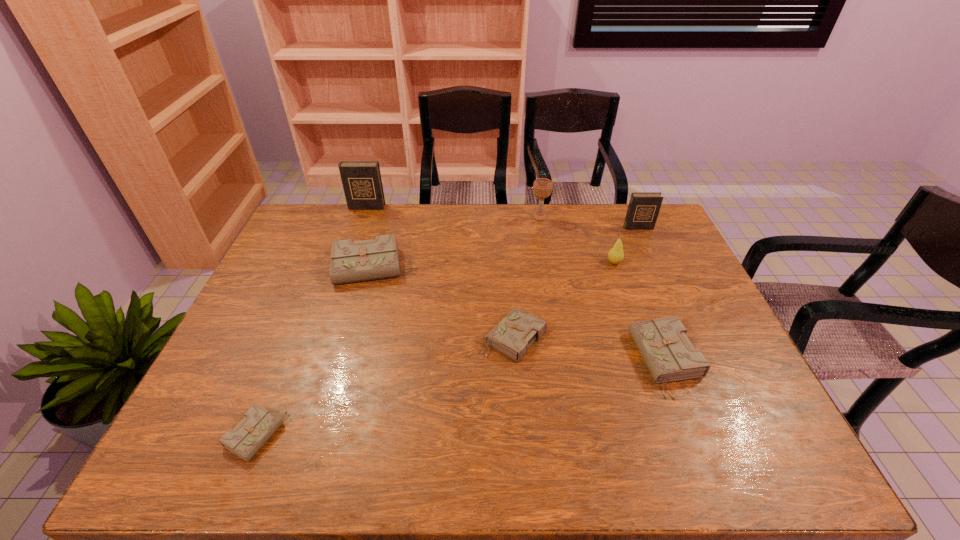
I want to click on free space that satisfies the following two spatial constraints: 1. on the front side of the farthest green diary; 2. on the left side of the second biggest green diary, so click(x=348, y=361).

At what (x,y) coordinates should I click in order to perform the action: click on free space in the image that satisfies the following two spatial constraints: 1. on the back side of the rightmost green diary; 2. on the right side of the smallest green diary. Please return your answer as a coordinate pair (x, y). Looking at the image, I should click on (285, 361).

Locate an element on the screen. The width and height of the screenshot is (960, 540). vacant space that satisfies the following two spatial constraints: 1. on the front cover of the tallest diary; 2. on the right side of the fourth object from right to left is located at coordinates (363, 217).

What are the coordinates of `free region that satisfies the following two spatial constraints: 1. on the front cover of the chalice; 2. on the left side of the tallest diary` in the screenshot? It's located at (363, 217).